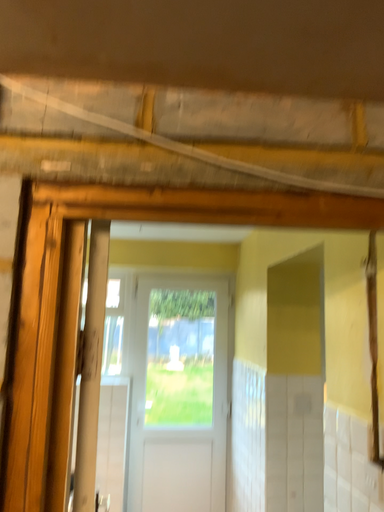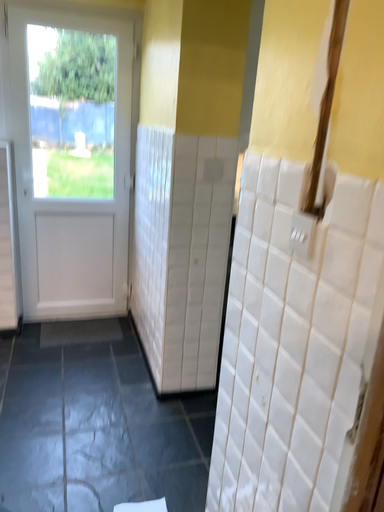
Question: How did the camera likely rotate when shooting the video?

Choices:
 (A) rotated upward
 (B) rotated downward

Answer: (B)